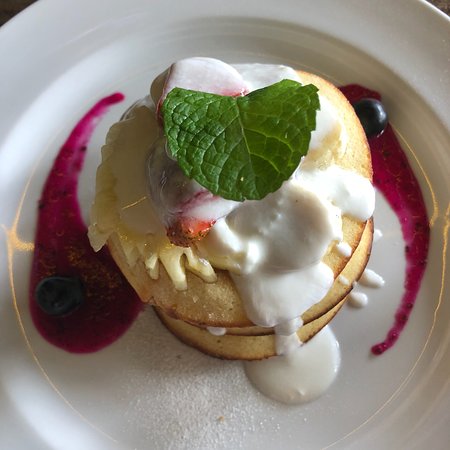
The image size is (450, 450). Find the location of `bowl rim`. bowl rim is located at coordinates (434, 21), (39, 43), (8, 432), (438, 423).